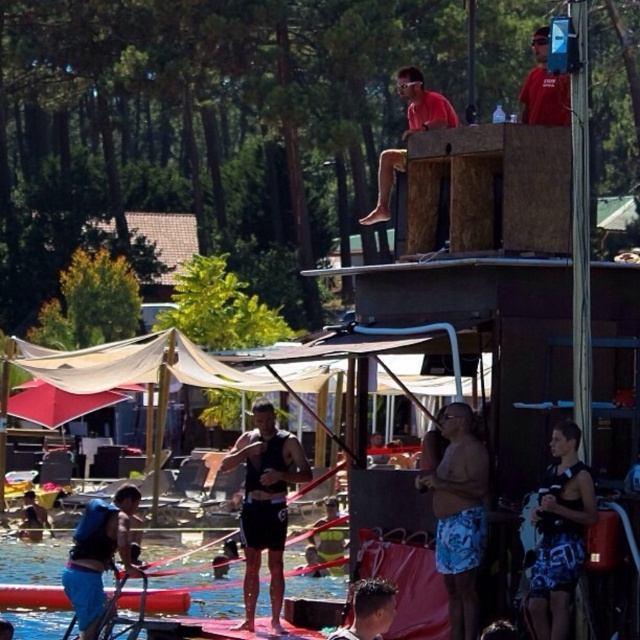
Question: Can you confirm if blue printed shorts at center is positioned below red matte shirt at upper center?

Choices:
 (A) yes
 (B) no

Answer: (A)

Question: Can you confirm if blue fabric water at lower left is smaller than matte red shirt at upper center?

Choices:
 (A) yes
 (B) no

Answer: (A)

Question: Among these objects, which one is farthest from the camera?

Choices:
 (A) blue fabric life vest at lower left
 (B) black matte tank top at center

Answer: (B)

Question: Considering the relative positions of black matte tank top at center and blue fabric life vest at lower left in the image provided, where is black matte tank top at center located with respect to blue fabric life vest at lower left?

Choices:
 (A) left
 (B) right

Answer: (B)

Question: Which object is farther from the camera taking this photo?

Choices:
 (A) black matte tank top at center
 (B) blue printed shorts at lower right
 (C) blue fabric water at lower left

Answer: (C)

Question: Which point appears farthest from the camera in this image?

Choices:
 (A) click(x=349, y=625)
 (B) click(x=426, y=99)
 (C) click(x=252, y=616)

Answer: (B)